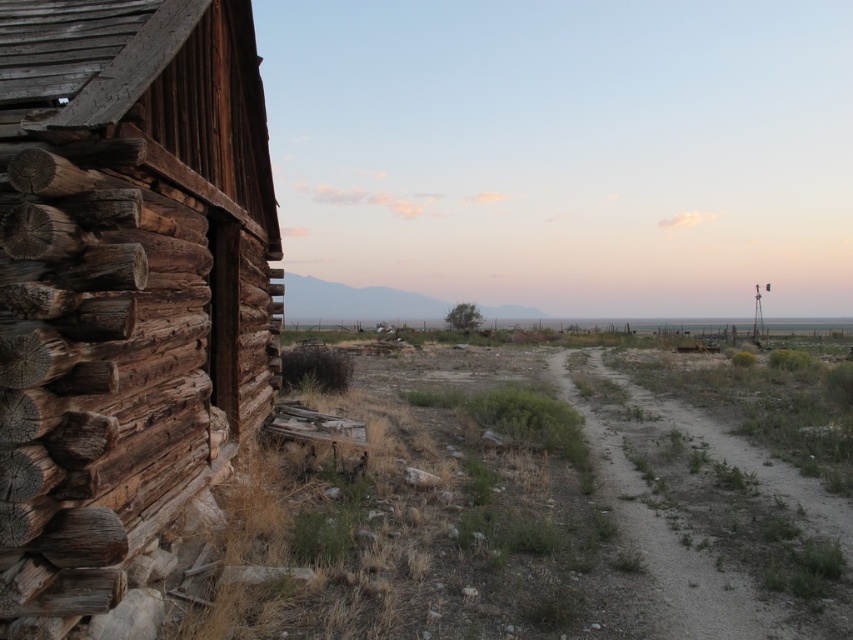
Question: In this image, where is weathered wood log cabin at left located relative to dusty gravel trail at center-right?

Choices:
 (A) left
 (B) right

Answer: (A)

Question: Which object is closer to the camera taking this photo?

Choices:
 (A) dusty gravel trail at center-right
 (B) weathered wood log cabin at left

Answer: (B)

Question: Can you confirm if weathered wood log cabin at left is bigger than dusty gravel trail at center-right?

Choices:
 (A) yes
 (B) no

Answer: (B)

Question: Can you confirm if weathered wood log cabin at left is positioned below dusty gravel trail at center-right?

Choices:
 (A) no
 (B) yes

Answer: (A)